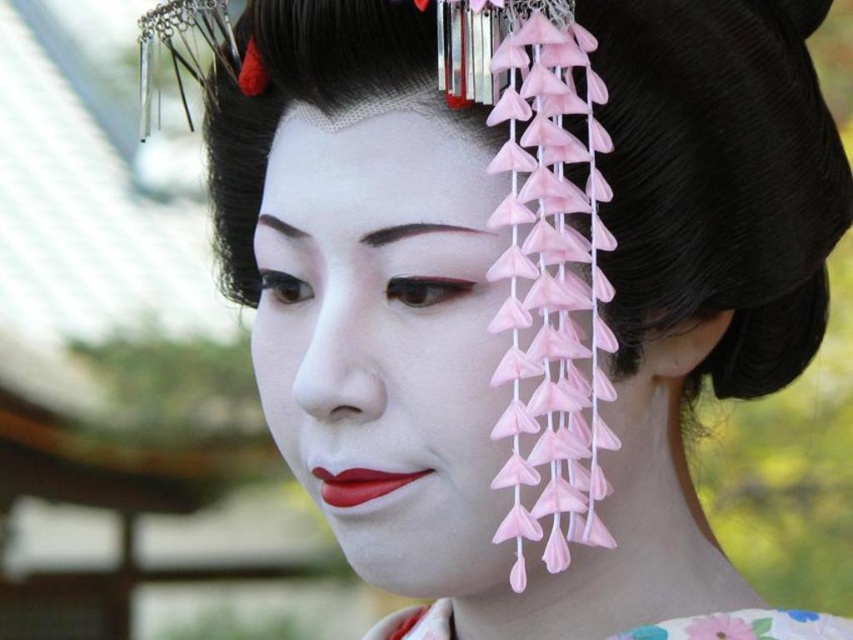
Question: Which point is farther to the camera?

Choices:
 (A) matte red lipstick at center
 (B) floral silk kimono at lower center
 (C) matte white face at center

Answer: (B)

Question: Does matte white face at center appear over floral silk kimono at lower center?

Choices:
 (A) yes
 (B) no

Answer: (A)

Question: Which object appears farthest from the camera in this image?

Choices:
 (A) floral silk kimono at lower center
 (B) matte red lipstick at center
 (C) matte white face at center

Answer: (A)

Question: From the image, what is the correct spatial relationship of matte white face at center in relation to matte red lipstick at center?

Choices:
 (A) left
 (B) right

Answer: (B)

Question: Which point is closer to the camera taking this photo?

Choices:
 (A) (334, 483)
 (B) (381, 140)
 (C) (730, 616)

Answer: (B)

Question: Is matte white face at center to the right of matte red lipstick at center from the viewer's perspective?

Choices:
 (A) no
 (B) yes

Answer: (B)